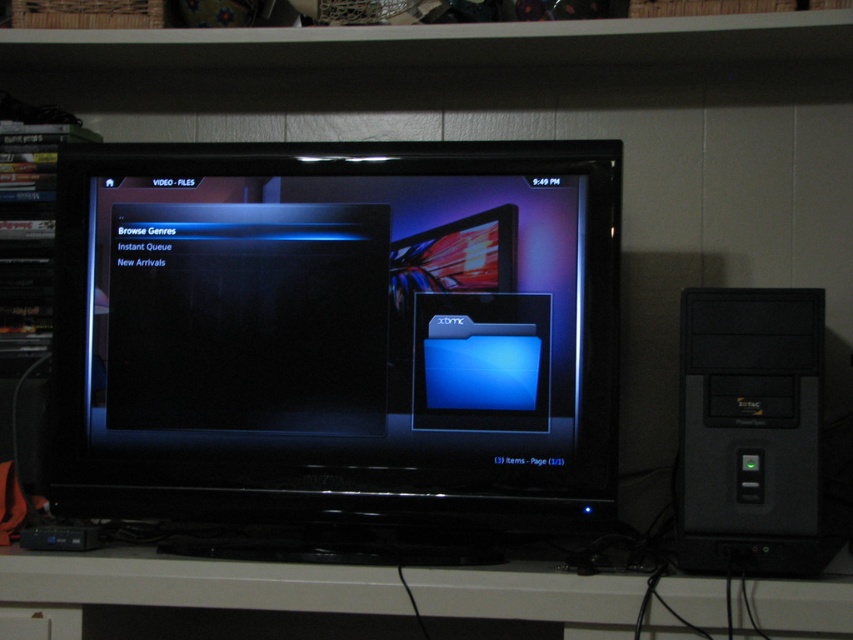
Does black glossy monitor at center come behind white matte computer desk at lower center?

Yes.

In the scene shown: Can you confirm if black glossy monitor at center is positioned above white matte computer desk at lower center?

Correct, black glossy monitor at center is located above white matte computer desk at lower center.

Between point (434, 454) and point (848, 589), which one is positioned behind?

The point (434, 454) is behind.

The image size is (853, 640). Identify the location of black glossy monitor at center. (337, 333).

Is white matte computer desk at lower center to the left of black plastic desktop computer at right from the viewer's perspective?

Indeed, white matte computer desk at lower center is positioned on the left side of black plastic desktop computer at right.

Between white matte computer desk at lower center and black plastic desktop computer at right, which one appears on the left side from the viewer's perspective?

white matte computer desk at lower center is more to the left.

Between point (627, 595) and point (741, 424), which one is positioned behind?

The point (741, 424) is more distant.

You are a GUI agent. You are given a task and a screenshot of the screen. Output one action in this format:
    pyautogui.click(x=<x>, y=<y>)
    Task: Click on the white matte computer desk at lower center
    The height and width of the screenshot is (640, 853).
    Given the screenshot: What is the action you would take?
    pyautogui.click(x=196, y=582)

Which is above, black glossy monitor at center or black plastic desktop computer at right?

black glossy monitor at center

Which is more to the left, black glossy monitor at center or black plastic desktop computer at right?

black glossy monitor at center

Is point (329, 214) behind point (821, 560)?

Yes, it is.

Locate an element on the screen. Image resolution: width=853 pixels, height=640 pixels. black glossy monitor at center is located at coordinates (337, 333).